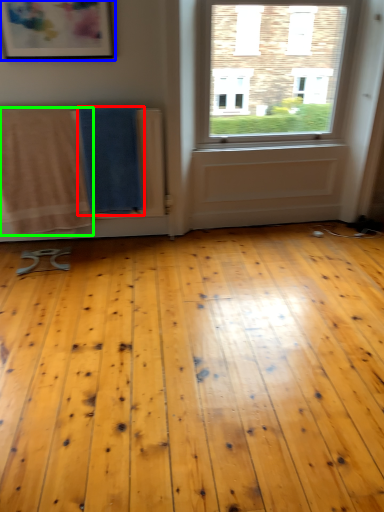
Question: Estimate the real-world distances between objects in this image. Which object is farther from beach towel (highlighted by a red box), picture frame (highlighted by a blue box) or beach towel (highlighted by a green box)?

Choices:
 (A) picture frame
 (B) beach towel

Answer: (A)